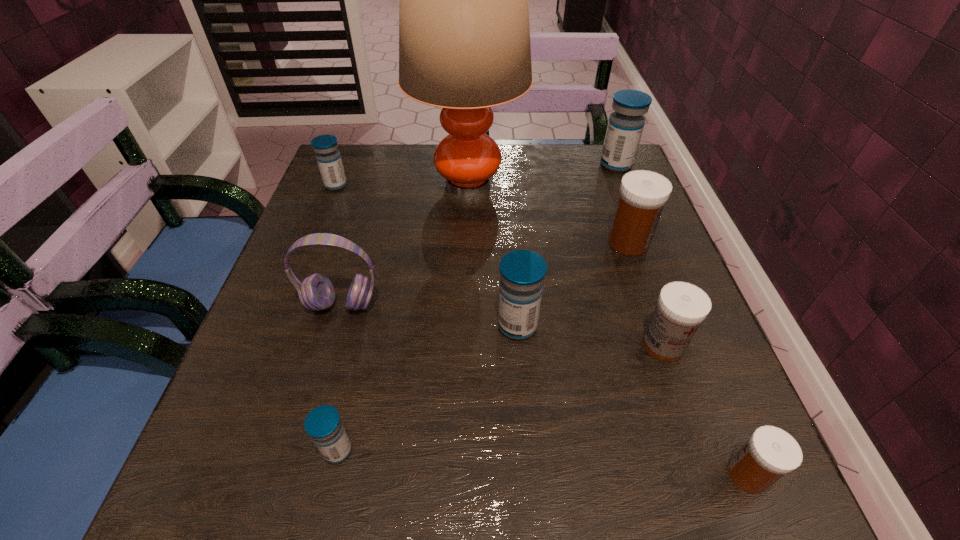
Image resolution: width=960 pixels, height=540 pixels. Find the location of `the second closest white medicine to the smallest white medicine`. the second closest white medicine to the smallest white medicine is located at coordinates (643, 194).

Point out which white medicine is positioned as the third nearest to the second medicine from left to right. Please provide its 2D coordinates. Your answer should be formatted as a tuple, i.e. [(x, y)], where the tuple contains the x and y coordinates of a point satisfying the conditions above.

[(643, 194)]

This screenshot has height=540, width=960. Find the location of `vacant space that satisfies the following two spatial constraints: 1. on the headband and ear cups of the headset; 2. on the left side of the second medicine from left to right`. vacant space that satisfies the following two spatial constraints: 1. on the headband and ear cups of the headset; 2. on the left side of the second medicine from left to right is located at coordinates (300, 450).

In order to click on free location that satisfies the following two spatial constraints: 1. on the front side of the nearest white medicine; 2. on the right side of the biggest white medicine in this screenshot , I will do `click(710, 475)`.

The height and width of the screenshot is (540, 960). What are the coordinates of `vacant space that satisfies the following two spatial constraints: 1. on the back side of the farthest blue medicine; 2. on the right side of the second nearest blue medicine` in the screenshot? It's located at (506, 165).